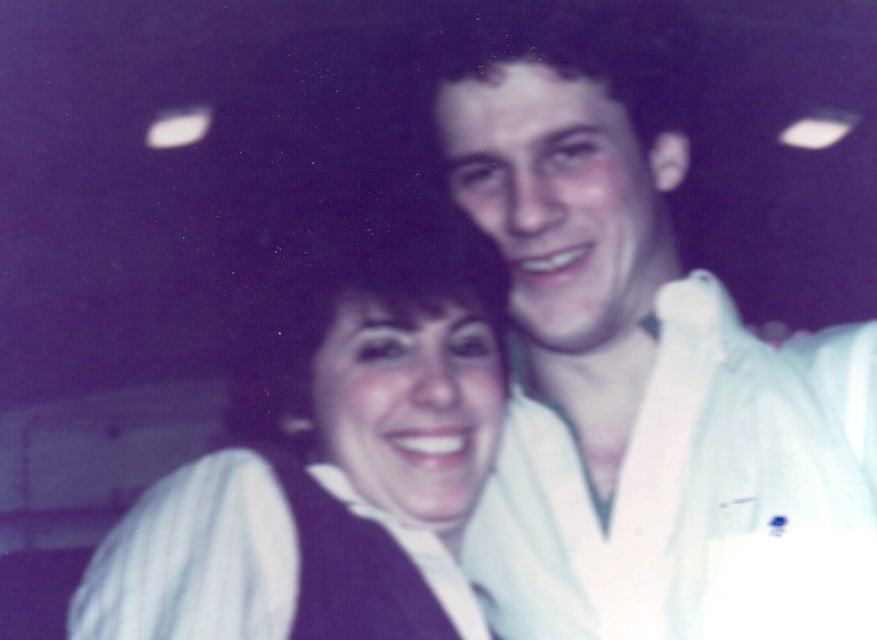
Which is below, matte white shirt at center or white cotton robe at upper right?

matte white shirt at center is lower down.

Does matte white shirt at center have a greater height compared to white cotton robe at upper right?

Yes, matte white shirt at center is taller than white cotton robe at upper right.

Is point (455, 611) more distant than point (704, 403)?

No.

You are a GUI agent. You are given a task and a screenshot of the screen. Output one action in this format:
    pyautogui.click(x=<x>, y=<y>)
    Task: Click on the matte white shirt at center
    This screenshot has height=640, width=877.
    Given the screenshot: What is the action you would take?
    pyautogui.click(x=333, y=468)

Who is more forward, [745,509] or [318,470]?

Positioned in front is point [318,470].

Is point (754, 461) closer to camera compared to point (250, 637)?

That is False.

Between point (690, 364) and point (247, 483), which one is positioned behind?

Point (690, 364)

At what (x,y) coordinates should I click in order to perform the action: click on white cotton robe at upper right. Please return your answer as a coordinate pair (x, y). The width and height of the screenshot is (877, 640). Looking at the image, I should click on (696, 493).

Does matte white shirt at center lie behind white striped fabric at center?

No, matte white shirt at center is closer to the viewer.

Between point (83, 598) and point (212, 524), which one is positioned in front?

Point (212, 524) is more forward.

You are a GUI agent. You are given a task and a screenshot of the screen. Output one action in this format:
    pyautogui.click(x=<x>, y=<y>)
    Task: Click on the matte white shirt at center
    The width and height of the screenshot is (877, 640).
    Given the screenshot: What is the action you would take?
    pyautogui.click(x=333, y=468)